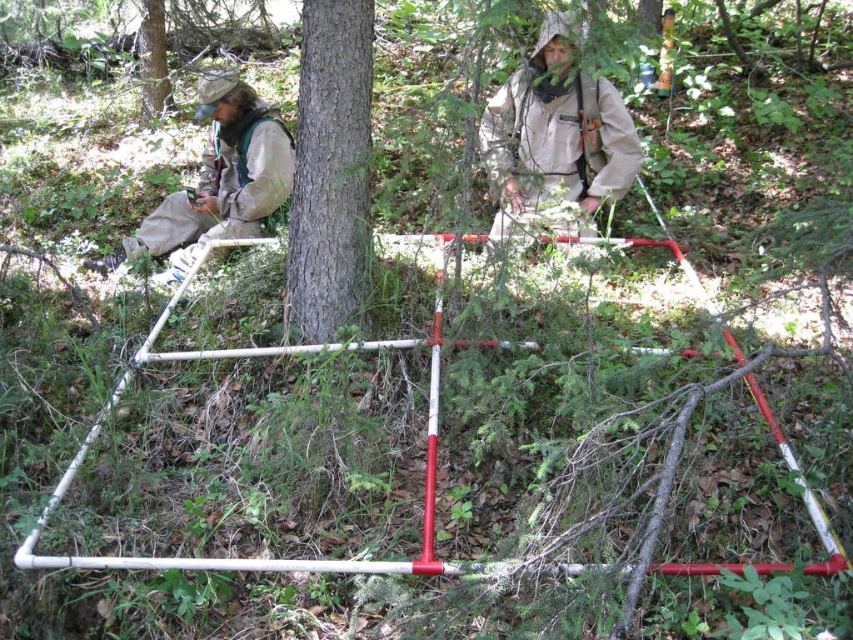
You are a hiker who needs to navigate between two marked points in the forest. The first point is at coordinate point(335, 298) and the second is at point(144, 49). Which point is closer to you if you are standing at the starting point?

Point(335, 298) is closer to the viewer than point(144, 49), so the first point is closer.